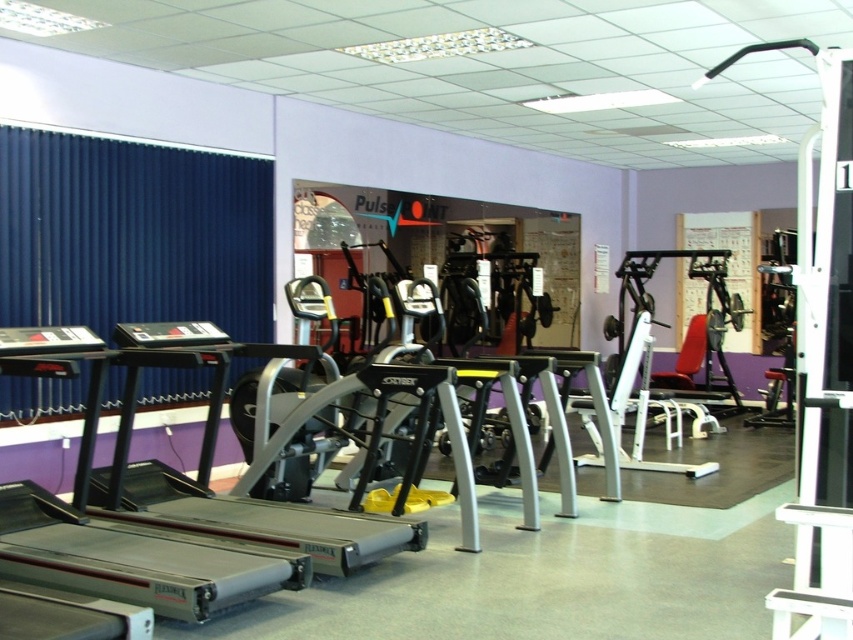
Question: Which object appears closest to the camera in this image?

Choices:
 (A) silver metallic treadmill at center
 (B) silver metallic treadmill at lower left
 (C) metallic silver weight machine at right

Answer: (C)

Question: Is metallic silver weight machine at right positioned behind silver metallic treadmill at center?

Choices:
 (A) no
 (B) yes

Answer: (A)

Question: Among these objects, which one is nearest to the camera?

Choices:
 (A) silver metallic treadmill at center
 (B) metallic silver weight machine at right

Answer: (B)

Question: Does metallic silver weight machine at right have a smaller size compared to silver metallic treadmill at center?

Choices:
 (A) no
 (B) yes

Answer: (B)

Question: Does silver metallic treadmill at lower left appear on the right side of silver metallic treadmill at center?

Choices:
 (A) no
 (B) yes

Answer: (A)

Question: Which object is the farthest from the silver metallic treadmill at lower left?

Choices:
 (A) metallic silver weight machine at right
 (B) silver metallic treadmill at center

Answer: (A)